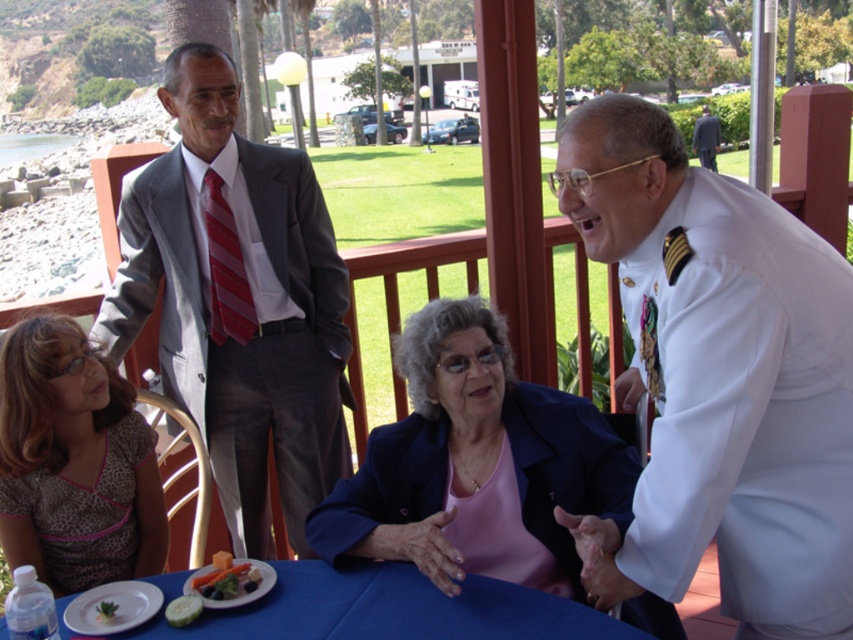
Question: Which is nearer to the gray suit at upper center?

Choices:
 (A) gray suit at left
 (B) green matte cucumber at lower left
 (C) white uniform at center
 (D) striped fabric tie at upper center

Answer: (A)

Question: Does blue fabric table at center appear on the right side of striped fabric tie at upper center?

Choices:
 (A) no
 (B) yes

Answer: (B)

Question: Among these objects, which one is farthest from the camera?

Choices:
 (A) matte blue blazer at center
 (B) fresh green broccoli at table center
 (C) gray suit at left
 (D) striped fabric tie at upper center

Answer: (D)

Question: Does fresh green broccoli at table center have a lesser width compared to gray suit at upper center?

Choices:
 (A) no
 (B) yes

Answer: (B)

Question: Is fresh green broccoli at table center smaller than gray suit at upper center?

Choices:
 (A) yes
 (B) no

Answer: (A)

Question: Which object is closer to the camera taking this photo?

Choices:
 (A) gray suit at upper center
 (B) green leafy vegetable at table

Answer: (B)